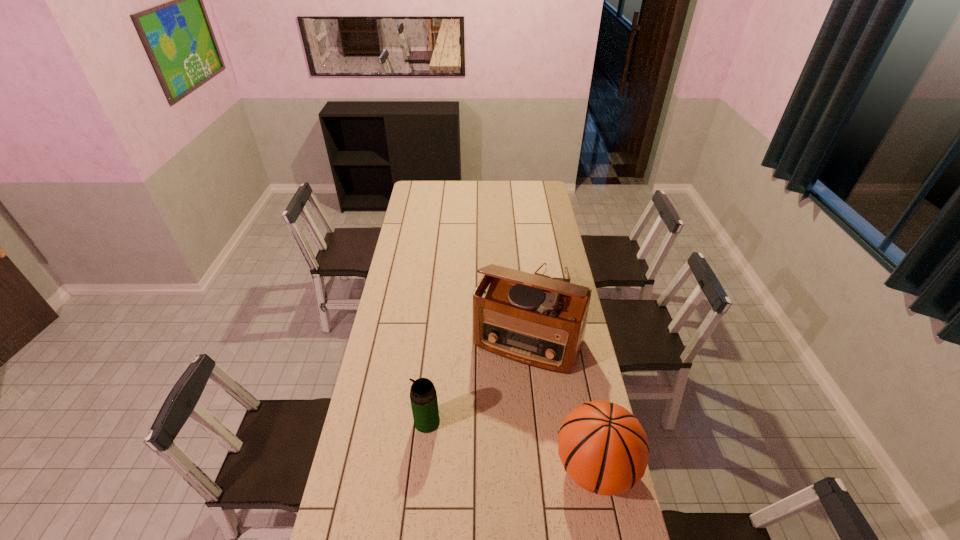
You are a GUI agent. You are given a task and a screenshot of the screen. Output one action in this format:
    pyautogui.click(x=<x>, y=<y>)
    Task: Click on the vacant space on the desktop that is between the leftmost object and the basketball and is positioned on the front panel of the radio receiver
    The width and height of the screenshot is (960, 540).
    Given the screenshot: What is the action you would take?
    pyautogui.click(x=489, y=438)

The image size is (960, 540). Identify the location of free spot on the desktop that is between the thermos bottle and the basketball and is positioned on the frames of the sunglasses. (505, 443).